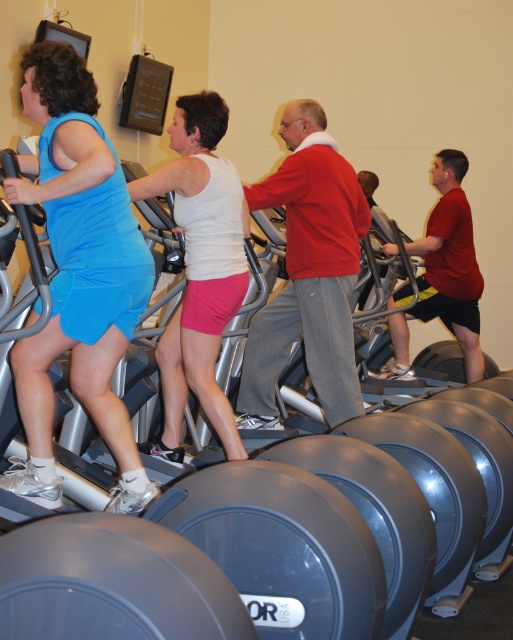
Does red cotton sweater at center appear on the right side of white matte tank top at center?

Correct, you'll find red cotton sweater at center to the right of white matte tank top at center.

Does red cotton sweater at center have a larger size compared to white matte tank top at center?

Yes.

Locate an element on the screen. red cotton sweater at center is located at coordinates (308, 273).

Is matte blue dress at left smaller than red cotton sweater at center?

Incorrect, matte blue dress at left is not smaller in size than red cotton sweater at center.

Which of these two, matte blue dress at left or red cotton sweater at center, stands taller?

With more height is red cotton sweater at center.

Does point (41, 196) come behind point (305, 202)?

That is False.

In order to click on matte blue dress at left in this screenshot , I will do `click(77, 275)`.

Describe the element at coordinates (77, 275) in the screenshot. I see `matte blue dress at left` at that location.

Is point (121, 349) farther from viewer compared to point (174, 314)?

No.

Find the location of a particular element. matte blue dress at left is located at coordinates (77, 275).